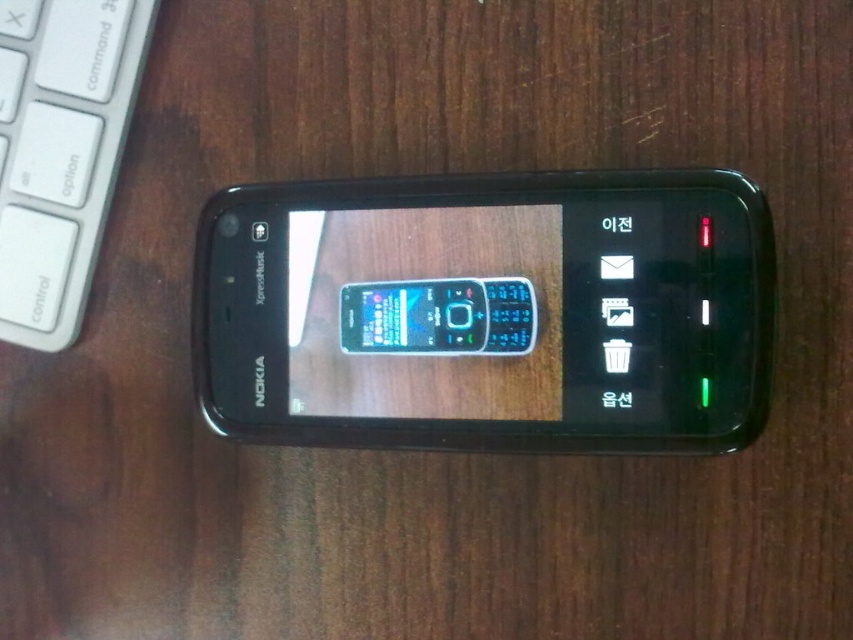
Question: Which point is closer to the camera?

Choices:
 (A) (554, 445)
 (B) (9, 58)

Answer: (A)

Question: Is black glossy smartphone at center wider than white plastic keyboard at upper left?

Choices:
 (A) yes
 (B) no

Answer: (A)

Question: Observing the image, what is the correct spatial positioning of black glossy smartphone at center in reference to white plastic keyboard at upper left?

Choices:
 (A) below
 (B) above

Answer: (A)

Question: Among these points, which one is farthest from the camera?

Choices:
 (A) (416, 372)
 (B) (61, 285)

Answer: (B)

Question: Considering the relative positions of black glossy smartphone at center and white plastic keyboard at upper left in the image provided, where is black glossy smartphone at center located with respect to white plastic keyboard at upper left?

Choices:
 (A) above
 (B) below

Answer: (B)